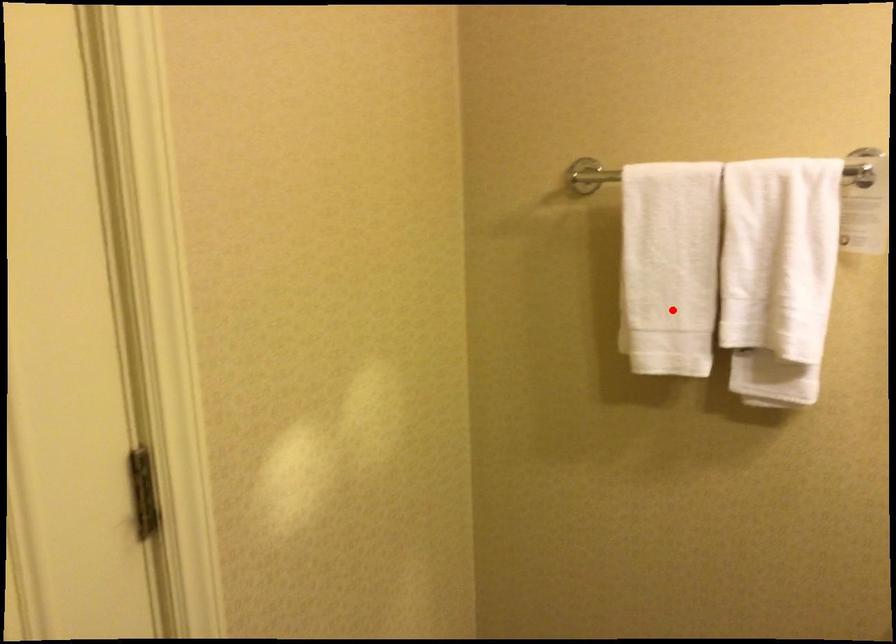
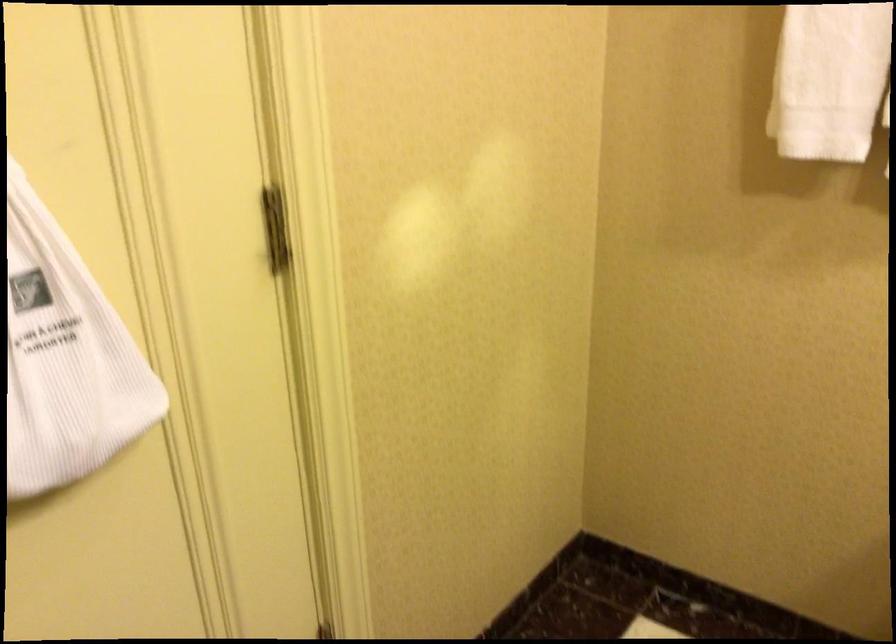
Find the pixel in the second image that matches the highlighted location in the first image.

(830, 80)